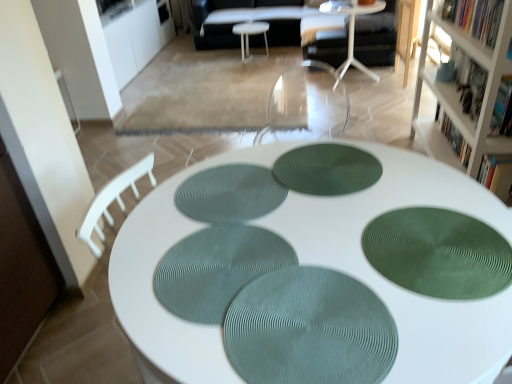
Identify the location of vacant area that is in front of green textured placemat at center, the 4th mat from the right. The image size is (512, 384). (236, 260).